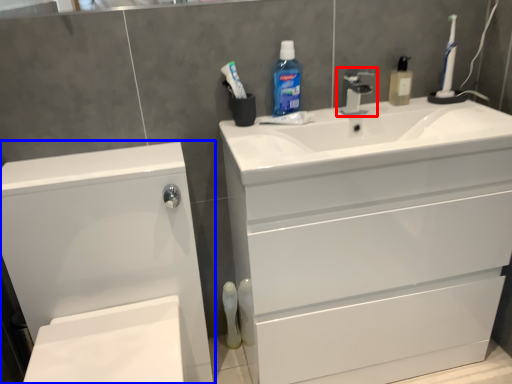
Question: Which object is closer to the camera taking this photo, tap (highlighted by a red box) or bathroom cabinet (highlighted by a blue box)?

Choices:
 (A) tap
 (B) bathroom cabinet

Answer: (B)